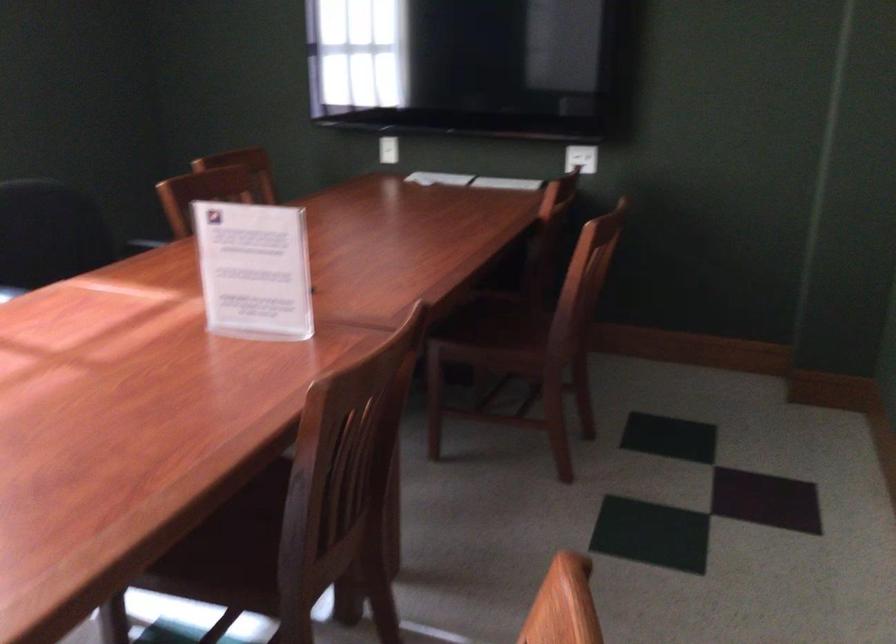
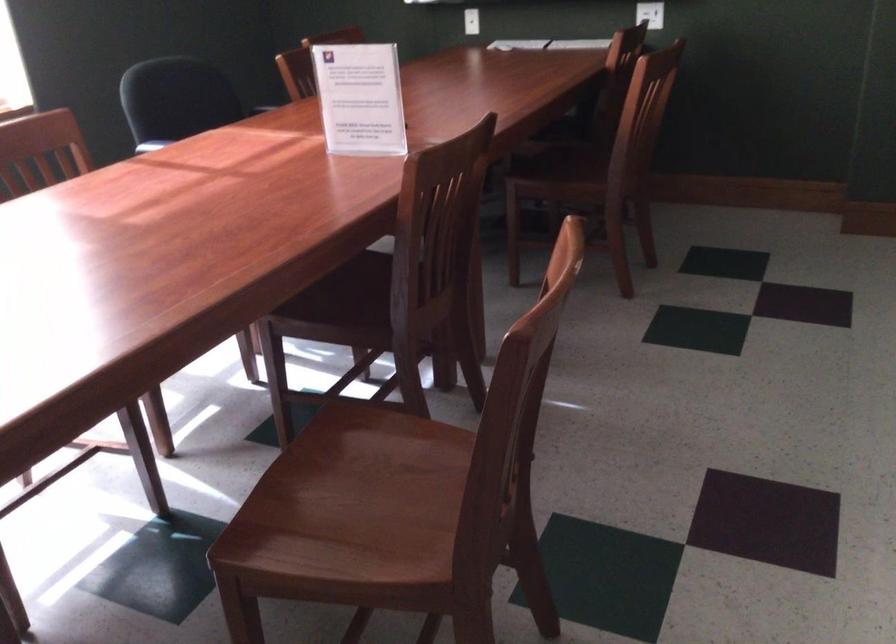
Where in the second image is the point corresponding to [490,319] from the first image?

(561, 158)